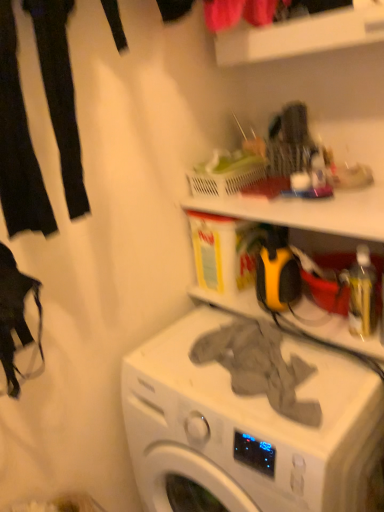
Question: In the image, is gray fabric at center positioned in front of or behind gray fabric at center, placed as the first clothing when sorted from bottom to top?

Choices:
 (A) behind
 (B) front

Answer: (B)

Question: Considering the positions of gray fabric at center and gray fabric at center, acting as the 1th clothing starting from the right, in the image, is gray fabric at center bigger or smaller than gray fabric at center, acting as the 1th clothing starting from the right,?

Choices:
 (A) big
 (B) small

Answer: (A)

Question: Which object is the farthest from the gray fabric at center, placed as the first clothing when sorted from bottom to top?

Choices:
 (A) gray fabric at center
 (B) translucent plastic basket at upper center
 (C) black fabric pants at left, which is the 1th clothing in left-to-right order

Answer: (C)

Question: Considering the real-world distances, which object is closest to the translucent plastic basket at upper center?

Choices:
 (A) gray fabric at center, which appears as the second clothing when viewed from the top
 (B) black fabric pants at left, the second clothing from the right
 (C) gray fabric at center

Answer: (A)